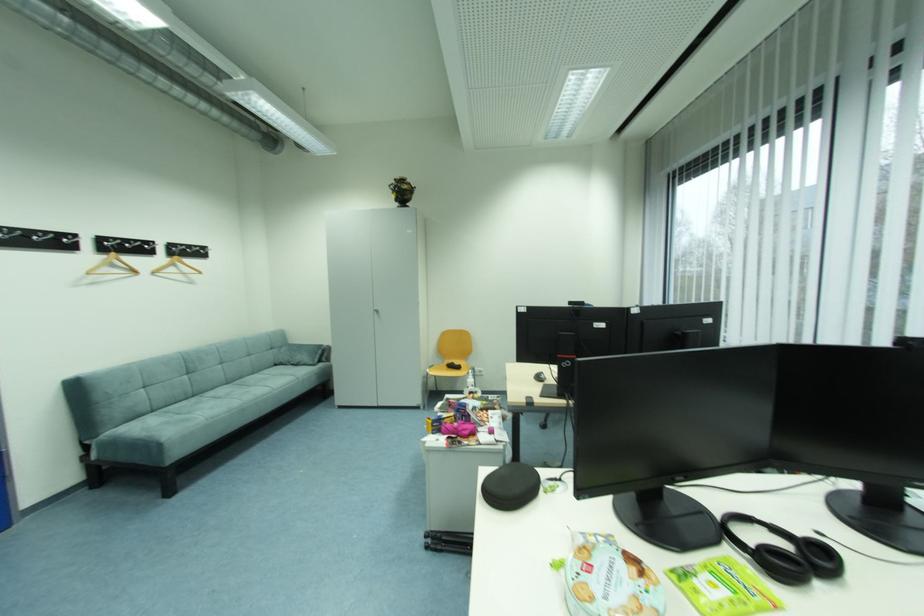
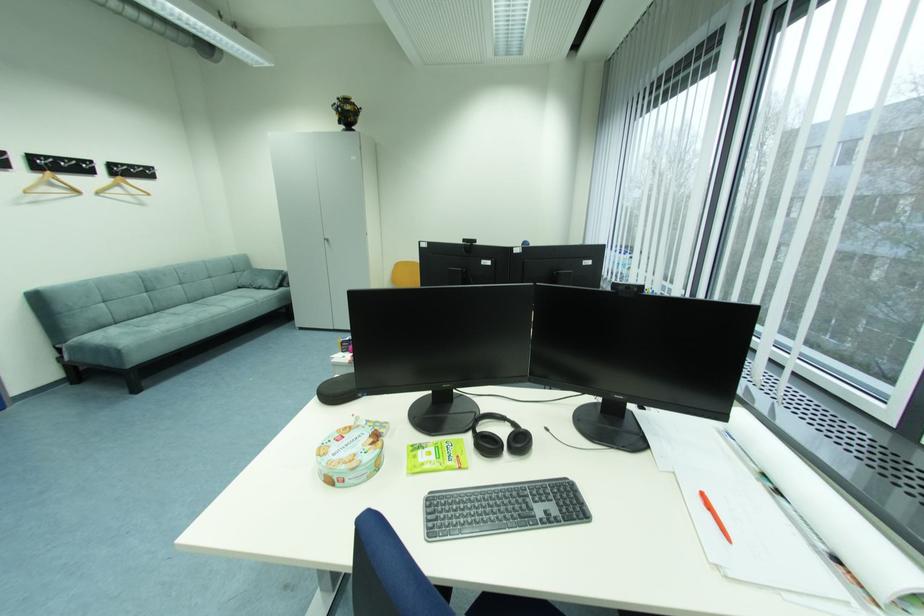
Where in the second image is the point corresponding to point 120,267 from the first image?

(59, 185)